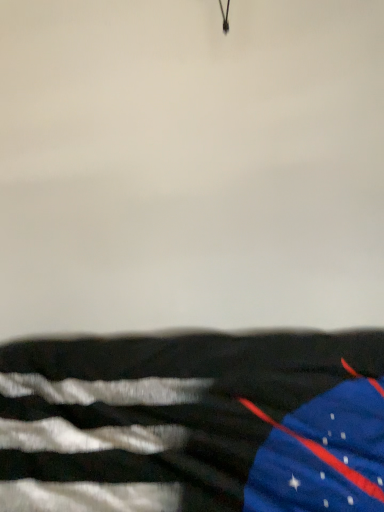
Describe the element at coordinates (193, 423) in the screenshot. I see `blue fabric flag at lower right` at that location.

You are a GUI agent. You are given a task and a screenshot of the screen. Output one action in this format:
    pyautogui.click(x=<x>, y=<y>)
    Task: Click on the blue fabric flag at lower right
    The width and height of the screenshot is (384, 512).
    Given the screenshot: What is the action you would take?
    pyautogui.click(x=193, y=423)

What is the approximate width of blue fabric flag at lower right?

The width of blue fabric flag at lower right is 4.17 feet.

You are a GUI agent. You are given a task and a screenshot of the screen. Output one action in this format:
    pyautogui.click(x=<x>, y=<y>)
    Task: Click on the blue fabric flag at lower right
    Image resolution: width=384 pixels, height=512 pixels.
    Given the screenshot: What is the action you would take?
    click(193, 423)